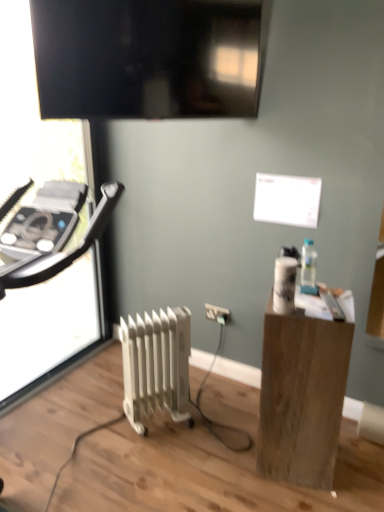
Where is `vacant space to the right of wooden block at right`? The image size is (384, 512). vacant space to the right of wooden block at right is located at coordinates (354, 466).